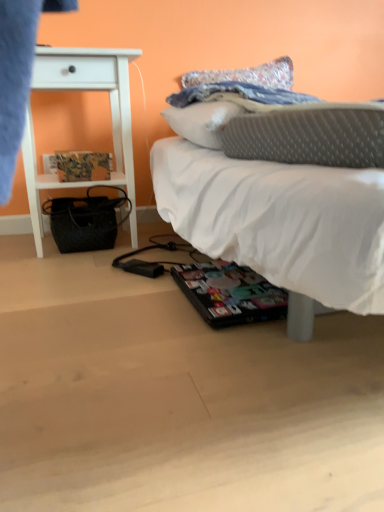
Identify the location of printed paper magazine at left. This screenshot has width=384, height=512. (83, 166).

Find the location of a particular element. white soft bed at center is located at coordinates (276, 187).

Between printed paper magazine at left and white soft bed at center, which one has larger width?

white soft bed at center.

Considering the relative sizes of printed paper magazine at left and white soft bed at center in the image provided, is printed paper magazine at left smaller than white soft bed at center?

Yes, printed paper magazine at left is smaller than white soft bed at center.

From their relative heights in the image, would you say printed paper magazine at left is taller or shorter than white wood nightstand at left?

printed paper magazine at left is shorter than white wood nightstand at left.

Is printed paper magazine at left closer to the viewer compared to white wood nightstand at left?

No, it is not.

I want to click on magazine on the right of white wood nightstand at left, so click(x=83, y=166).

Which of these two, printed paper magazine at left or white wood nightstand at left, is smaller?

printed paper magazine at left.

From a real-world perspective, is white wood nightstand at left physically located above or below white soft bed at center?

white wood nightstand at left is situated higher than white soft bed at center in the real world.

Between white wood nightstand at left and white soft bed at center, which one has larger width?

white soft bed at center.

Does white wood nightstand at left contain white soft bed at center?

No, white wood nightstand at left does not contain white soft bed at center.

From the image's perspective, is white wood nightstand at left below white soft bed at center?

No, from the image's perspective, white wood nightstand at left is not beneath white soft bed at center.

From a real-world perspective, is white soft bed at center physically below white wood nightstand at left?

Yes.

Is white soft bed at center surrounding white wood nightstand at left?

That's incorrect, white wood nightstand at left is not inside white soft bed at center.

In terms of width, does white soft bed at center look wider or thinner when compared to white wood nightstand at left?

Clearly, white soft bed at center has more width compared to white wood nightstand at left.

Image resolution: width=384 pixels, height=512 pixels. I want to click on bed located in front of the printed paper magazine at left, so click(x=276, y=187).

Is white soft bed at center to the right of printed paper magazine at left from the viewer's perspective?

Indeed, white soft bed at center is positioned on the right side of printed paper magazine at left.

Is white soft bed at center not within printed paper magazine at left?

white soft bed at center lies outside printed paper magazine at left's area.

Are white soft bed at center and printed paper magazine at left beside each other?

No, white soft bed at center is not next to printed paper magazine at left.

Looking at this image, could you tell me if white wood nightstand at left is turned towards printed paper magazine at left?

Yes, white wood nightstand at left is aimed at printed paper magazine at left.

Between white wood nightstand at left and printed paper magazine at left, which one appears on the right side from the viewer's perspective?

From the viewer's perspective, printed paper magazine at left appears more on the right side.

Is the surface of white wood nightstand at left in direct contact with printed paper magazine at left?

No, white wood nightstand at left is not in contact with printed paper magazine at left.

Which of these two, white wood nightstand at left or printed paper magazine at left, is smaller?

printed paper magazine at left.

This screenshot has width=384, height=512. In order to click on magazine that is above the white soft bed at center (from a real-world perspective) in this screenshot , I will do `click(83, 166)`.

You are a GUI agent. You are given a task and a screenshot of the screen. Output one action in this format:
    pyautogui.click(x=<x>, y=<y>)
    Task: Click on the magazine beneath the white wood nightstand at left (from a real-world perspective)
    The height and width of the screenshot is (512, 384).
    Given the screenshot: What is the action you would take?
    pyautogui.click(x=83, y=166)

Which object lies nearer to the anchor point printed paper magazine at left, white wood nightstand at left or white soft bed at center?

white wood nightstand at left is positioned closer to the anchor printed paper magazine at left.

Looking at the image, which one is located closer to white soft bed at center, printed paper magazine at left or white wood nightstand at left?

white wood nightstand at left lies closer to white soft bed at center than the other object.

When comparing their distances from white wood nightstand at left, does white soft bed at center or printed paper magazine at left seem further?

white soft bed at center is further to white wood nightstand at left.

Looking at the image, which one is located closer to white wood nightstand at left, printed paper magazine at left or white soft bed at center?

printed paper magazine at left is positioned closer to the anchor white wood nightstand at left.

Which object lies nearer to the anchor point white soft bed at center, white wood nightstand at left or printed paper magazine at left?

white wood nightstand at left is closer to white soft bed at center.

Estimate the real-world distances between objects in this image. Which object is closer to printed paper magazine at left, white soft bed at center or white wood nightstand at left?

white wood nightstand at left lies closer to printed paper magazine at left than the other object.

Image resolution: width=384 pixels, height=512 pixels. I want to click on magazine situated between white wood nightstand at left and white soft bed at center from left to right, so click(83, 166).